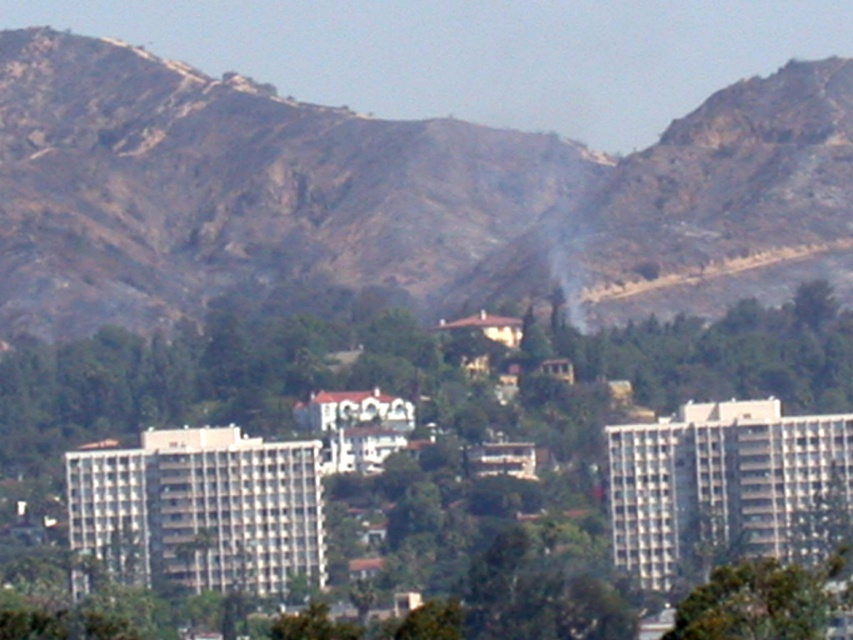
Can you confirm if green leafy tree at center is thinner than green leafy tree at lower right?

No, green leafy tree at center is not thinner than green leafy tree at lower right.

Does point (70, 508) come closer to viewer compared to point (705, 624)?

No, it is behind (705, 624).

The height and width of the screenshot is (640, 853). Find the location of `green leafy tree at center`. green leafy tree at center is located at coordinates (x=383, y=460).

Which of these two, brown rocky mountain at center or green leafy tree at center, stands taller?

green leafy tree at center

Who is more distant from viewer, (x=213, y=209) or (x=219, y=467)?

Point (x=213, y=209)

Identify the location of brown rocky mountain at center. This screenshot has height=640, width=853. (381, 193).

Where is `brown rocky mountain at center`? brown rocky mountain at center is located at coordinates (381, 193).

Is point (590, 257) positioned before point (717, 624)?

Yes, it is in front of point (717, 624).

This screenshot has height=640, width=853. Find the location of `brown rocky mountain at center`. brown rocky mountain at center is located at coordinates (381, 193).